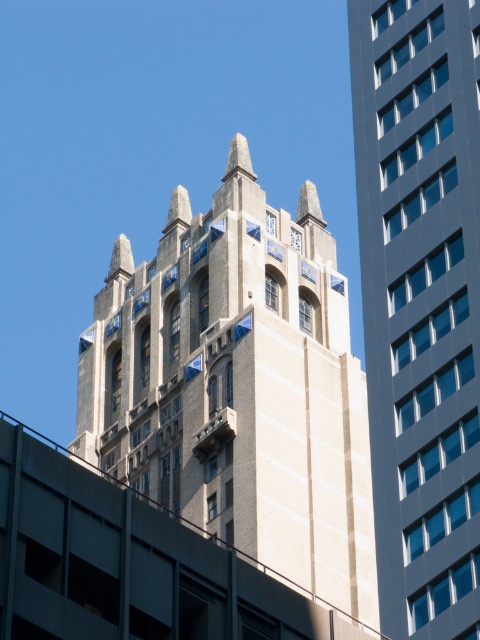
Question: Which object appears farthest from the camera in this image?

Choices:
 (A) smooth gray building at center
 (B) beige stone tower at center

Answer: (B)

Question: Considering the relative positions of beige stone tower at center and smooth gray building at center in the image provided, where is beige stone tower at center located with respect to smooth gray building at center?

Choices:
 (A) left
 (B) right

Answer: (A)

Question: Can you confirm if beige stone tower at center is bigger than smooth gray building at center?

Choices:
 (A) no
 (B) yes

Answer: (B)

Question: Does beige stone tower at center have a smaller size compared to smooth gray building at center?

Choices:
 (A) no
 (B) yes

Answer: (A)